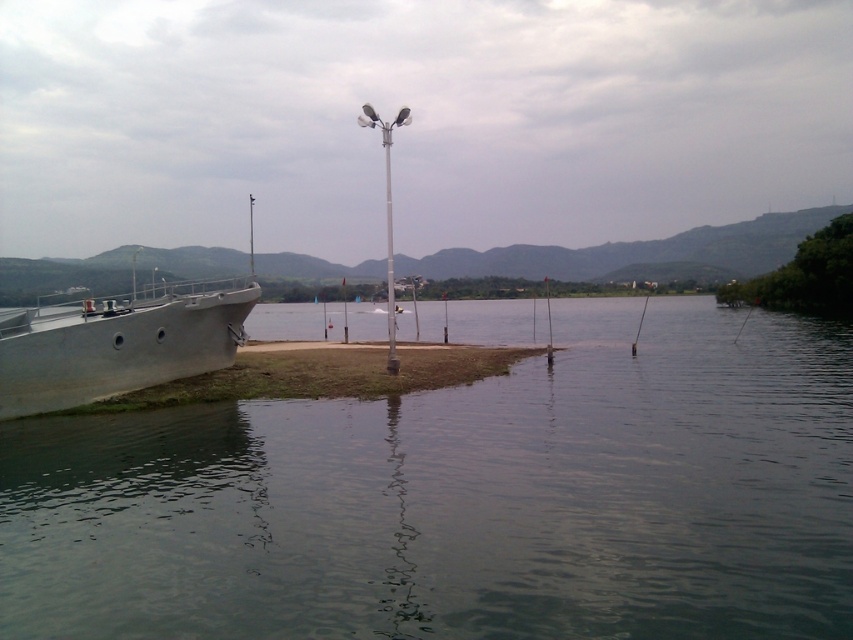
Question: Observing the image, what is the correct spatial positioning of greenish water at lower left in reference to white plastic pole at center?

Choices:
 (A) below
 (B) above

Answer: (A)

Question: Which of the following is the farthest from the observer?

Choices:
 (A) greenish water at lower left
 (B) silver metallic boat at left
 (C) white plastic pole at center

Answer: (C)

Question: Which object is positioned farthest from the greenish water at lower left?

Choices:
 (A) silver metallic boat at left
 (B) white plastic pole at center

Answer: (B)

Question: Considering the real-world distances, which object is closest to the white plastic pole at center?

Choices:
 (A) greenish water at lower left
 (B) silver metallic boat at left

Answer: (A)

Question: Where is greenish water at lower left located in relation to white plastic pole at center in the image?

Choices:
 (A) right
 (B) left

Answer: (A)

Question: Is greenish water at lower left to the right of silver metallic boat at left from the viewer's perspective?

Choices:
 (A) no
 (B) yes

Answer: (B)